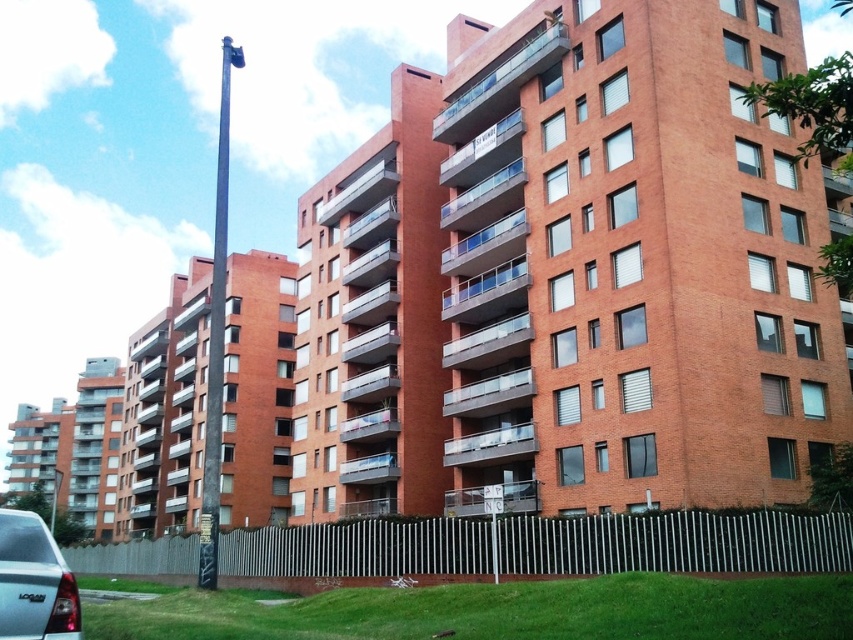
Measure the distance between matte black car at lower left and camera.

matte black car at lower left and camera are 7.15 meters apart.

Is point (26, 538) closer to viewer compared to point (212, 340)?

That is True.

The width and height of the screenshot is (853, 640). Identify the location of matte black car at lower left. (33, 580).